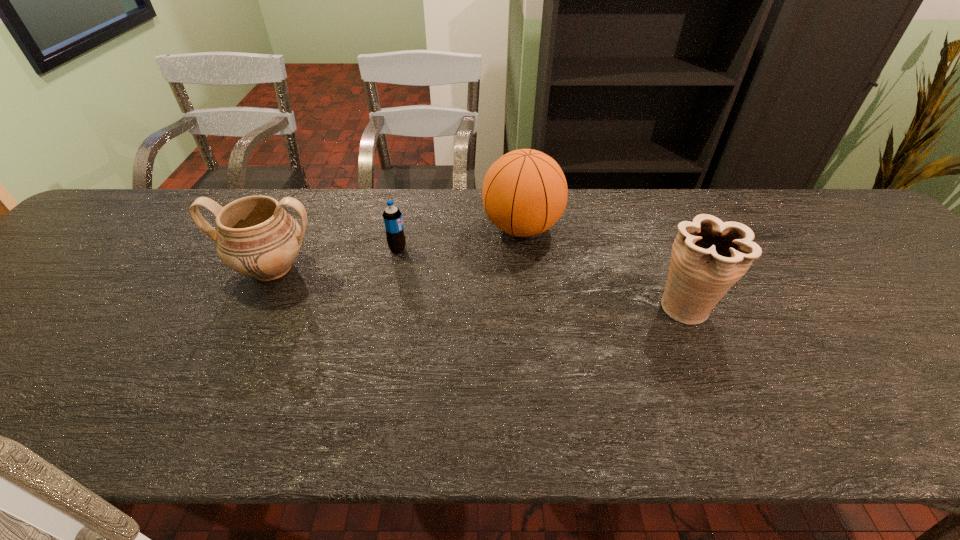
The image size is (960, 540). I want to click on vacant space that satisfies the following two spatial constraints: 1. on the front-facing side of the left urn; 2. on the left side of the rightmost object, so click(x=252, y=307).

This screenshot has height=540, width=960. What are the coordinates of `vacant region that satisfies the following two spatial constraints: 1. on the front-facing side of the right urn; 2. on the right side of the left urn` in the screenshot? It's located at (252, 307).